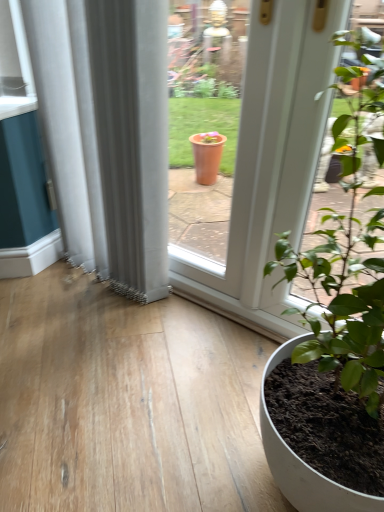
This screenshot has height=512, width=384. What do you see at coordinates (346, 258) in the screenshot?
I see `green matte plant at right` at bounding box center [346, 258].

The width and height of the screenshot is (384, 512). I want to click on green matte plant at right, so tap(346, 258).

Where is `green matte plant at right`? green matte plant at right is located at coordinates (346, 258).